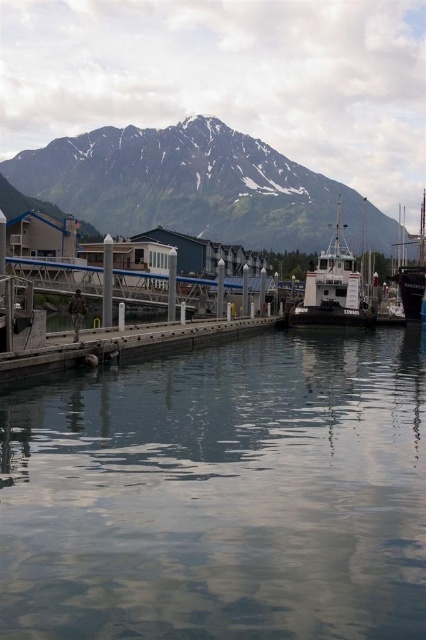
Can you confirm if clear water at center is bigger than shiny black sailboat at right?

No, clear water at center is not bigger than shiny black sailboat at right.

Is point (334, 426) in front of point (412, 272)?

Yes, point (334, 426) is in front of point (412, 272).

Is point (127, 541) positioned after point (405, 308)?

No, (127, 541) is in front of (405, 308).

Identify the location of clear water at center. (221, 496).

Does snowy granite mountain at upper center appear under white matte boat at center?

No.

Is snowy granite mountain at upper center bigger than white matte boat at center?

Correct, snowy granite mountain at upper center is larger in size than white matte boat at center.

Which is in front, point (227, 200) or point (313, 276)?

Point (313, 276) is more forward.

This screenshot has width=426, height=640. I want to click on snowy granite mountain at upper center, so click(x=195, y=186).

Measure the distance between point (417, 529) and camera.

The distance of point (417, 529) from camera is 34.31 meters.

Does clear water at center appear under white matte boat at center?

Yes.

Between point (241, 412) and point (287, 321), which one is positioned behind?

Positioned behind is point (287, 321).

Identify the location of clear water at center. (221, 496).